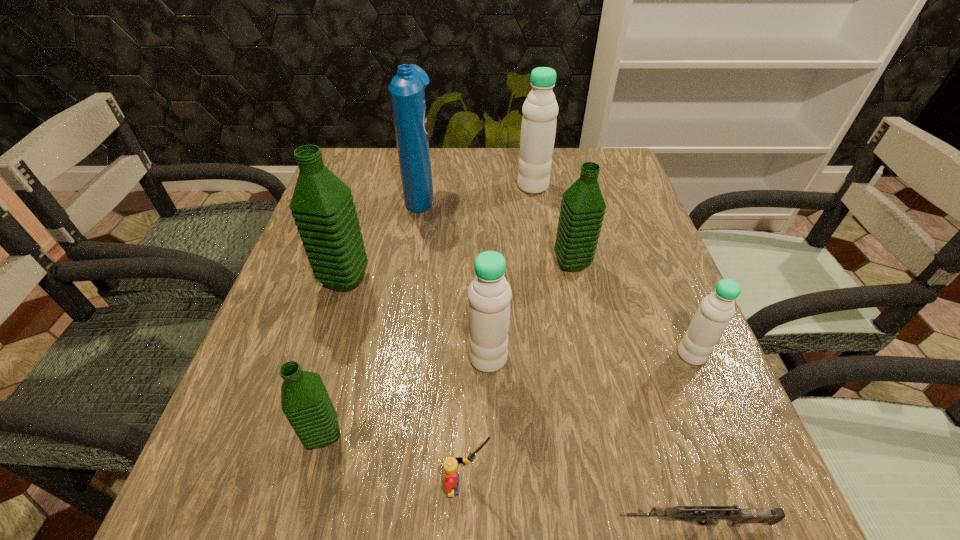
Find the location of a particular element. the nearest green water bottle is located at coordinates (305, 402).

Locate an element on the screen. The image size is (960, 540). Lego is located at coordinates (450, 465).

You are a GUI agent. You are given a task and a screenshot of the screen. Output one action in this format:
    pyautogui.click(x=<x>, y=<y>)
    Task: Click on the eighth tallest object
    Image resolution: width=960 pixels, height=540 pixels.
    Given the screenshot: What is the action you would take?
    pyautogui.click(x=450, y=465)

The width and height of the screenshot is (960, 540). I want to click on grey gun, so click(701, 515).

The width and height of the screenshot is (960, 540). Find the location of `gun`. gun is located at coordinates (701, 515).

Locate an element on the screen. vacant area located 0.220m on the right of the seventh object from right to left is located at coordinates (519, 192).

Locate an element on the screen. vacant region located on the left of the biggest white water bottle is located at coordinates (371, 186).

Locate an element on the screen. vacant space positioned on the right of the biggest green water bottle is located at coordinates (492, 280).

Locate an element on the screen. The height and width of the screenshot is (540, 960). vacant region located 0.160m on the left of the second smallest green water bottle is located at coordinates (480, 263).

Find the location of a particular element. This screenshot has height=540, width=960. free region located on the right of the second biggest white water bottle is located at coordinates (659, 358).